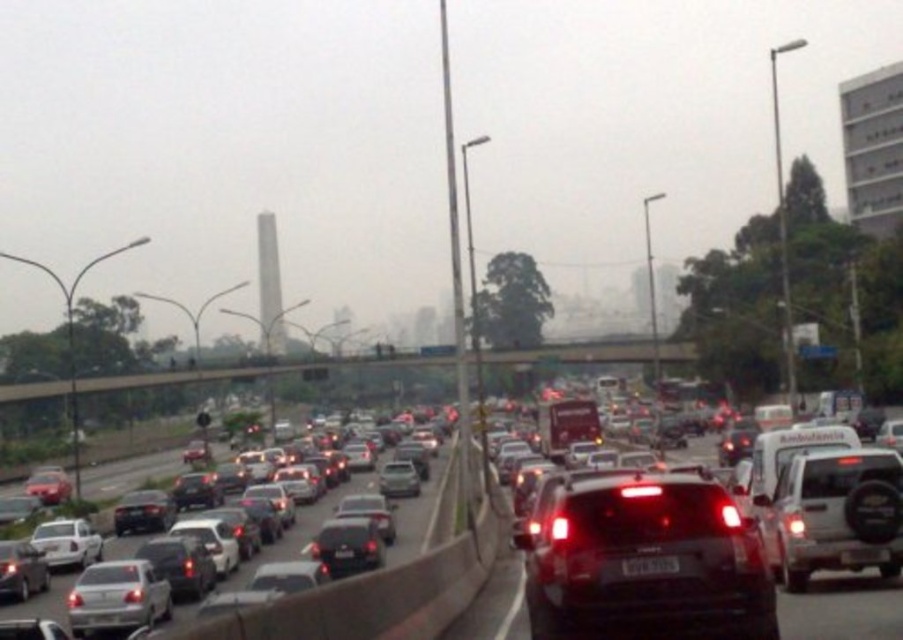
Question: Can you confirm if metallic cars at center is smaller than shiny black sedan at center?

Choices:
 (A) yes
 (B) no

Answer: (B)

Question: Does metallic cars at center appear over shiny black sedan at center?

Choices:
 (A) no
 (B) yes

Answer: (B)

Question: Estimate the real-world distances between objects in this image. Which object is farther from the metallic cars at center?

Choices:
 (A) black plastic license plate at center
 (B) satin black suv at center

Answer: (A)

Question: Among these objects, which one is nearest to the camera?

Choices:
 (A) metallic cars at center
 (B) black plastic license plate at center

Answer: (B)

Question: Estimate the real-world distances between objects in this image. Which object is closer to the metallic cars at center?

Choices:
 (A) satin black suv at center
 (B) black plastic license plate at center
 (C) shiny black sedan at center

Answer: (C)

Question: Is satin black suv at center bigger than metallic cars at center?

Choices:
 (A) yes
 (B) no

Answer: (B)